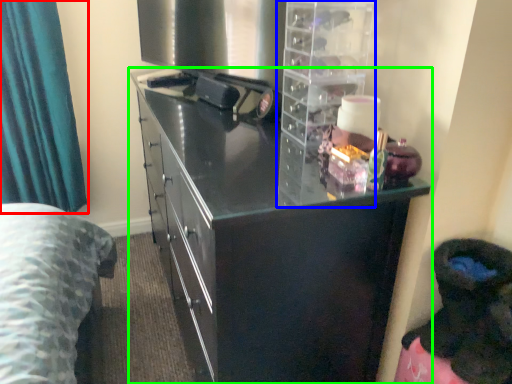
Question: Based on their relative distances, which object is farther from curtain (highlighted by a red box)? Choose from cabinet (highlighted by a blue box) and cupboard (highlighted by a green box).

Choices:
 (A) cabinet
 (B) cupboard

Answer: (A)